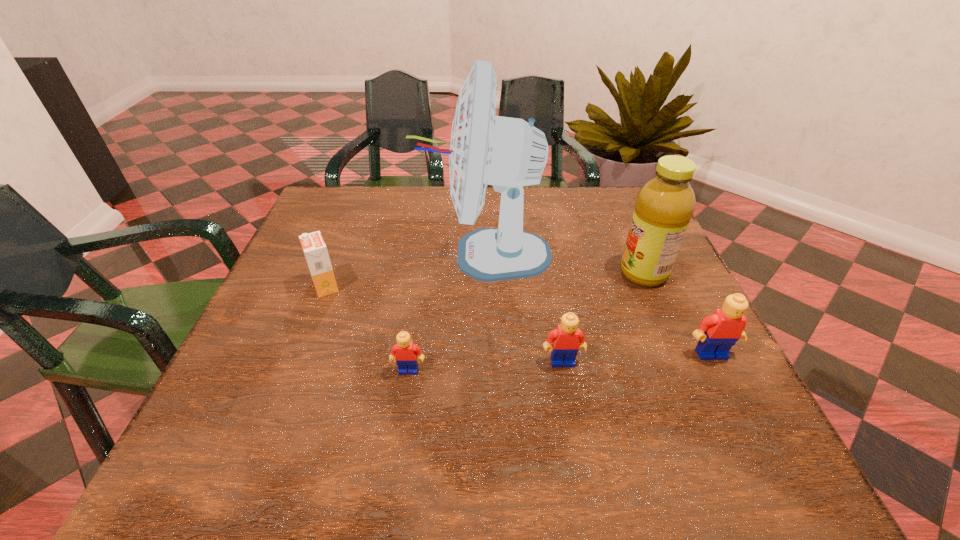
The height and width of the screenshot is (540, 960). What are the coordinates of `free space between the orange juice and the leftmost Lego` in the screenshot? It's located at (367, 328).

At what (x,y) coordinates should I click in order to perform the action: click on vacant space that is in between the second Lego from right to left and the second tallest object. Please return your answer as a coordinate pair (x, y). Looking at the image, I should click on (603, 318).

The image size is (960, 540). Identify the location of vacant space that's between the second tallest object and the shortest Lego. (526, 322).

Locate an element on the screen. The image size is (960, 540). free area in between the second Lego from right to left and the fruit juice is located at coordinates (603, 318).

In order to click on vacant space that's between the orange juice and the tallest object in this screenshot , I will do `click(406, 271)`.

The height and width of the screenshot is (540, 960). I want to click on vacant area that lies between the second tallest Lego and the shortest object, so click(x=486, y=366).

What are the coordinates of `unoccupied area between the orange juice and the fan` in the screenshot? It's located at (406, 271).

Find the location of a particular element. The width and height of the screenshot is (960, 540). object that is the second closest one to the second tallest Lego is located at coordinates (717, 333).

Select which object appears as the third closest to the fruit juice. Please provide its 2D coordinates. Your answer should be formatted as a tuple, i.e. [(x, y)], where the tuple contains the x and y coordinates of a point satisfying the conditions above.

[(567, 339)]

Find the location of a particular element. This screenshot has height=540, width=960. the closest Lego to the leftmost Lego is located at coordinates (567, 339).